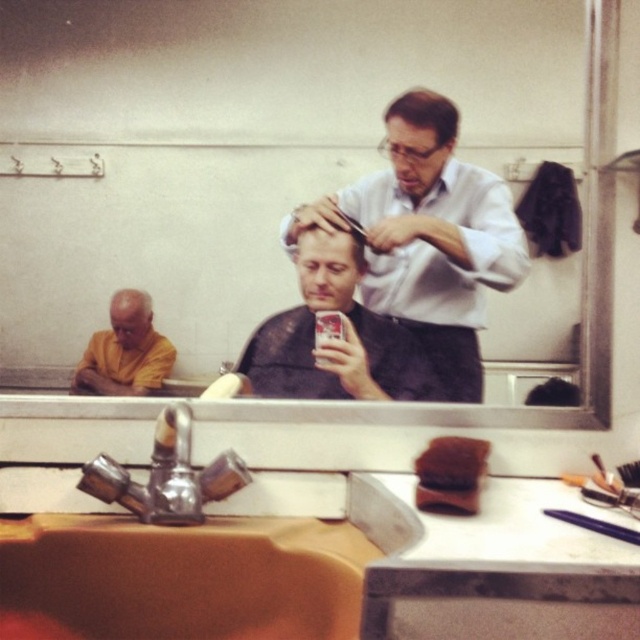
Based on the photo, you are a customer in a barbershop and want to locate the reflective glass mirror at center. According to the coordinates provided, where would you find it?

The reflective glass mirror at center is located at point coordinates (280, 164).

You are a customer in the barbershop and need to wash your hands. The brushed metal faucet at lower left is the only one available. Can you reach it while standing at the smooth brown hair at center position?

The brushed metal faucet at lower left might be wider than smooth brown hair at center, so it is possible to reach the faucet from the smooth brown hair at center position.

You are a customer in a barbershop and want to check your haircut in the mirror. The reflective glass mirror at center and smooth brown hair at center are both visible. Which one is taller?

The reflective glass mirror at center is taller than the smooth brown hair at center.